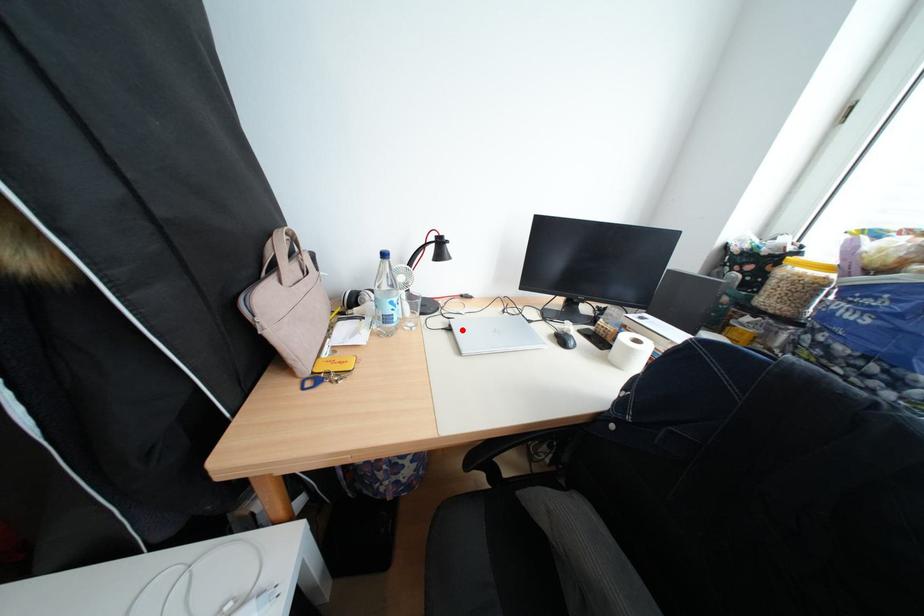
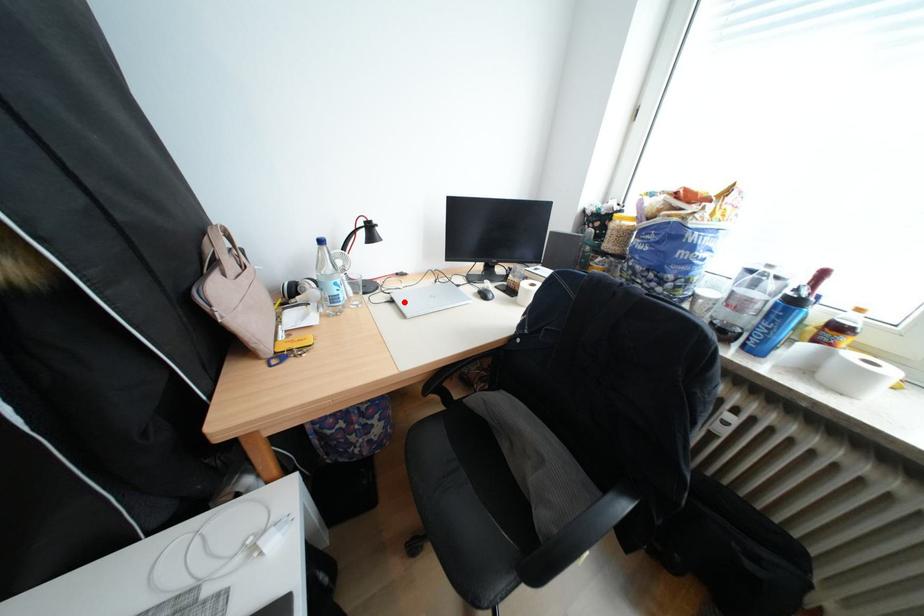
I am providing you with two images of the same scene from different viewpoints. A red point is marked on the first image and another point is marked on the second image. Are the points marked in image1 and image2 representing the same 3D position?

Yes